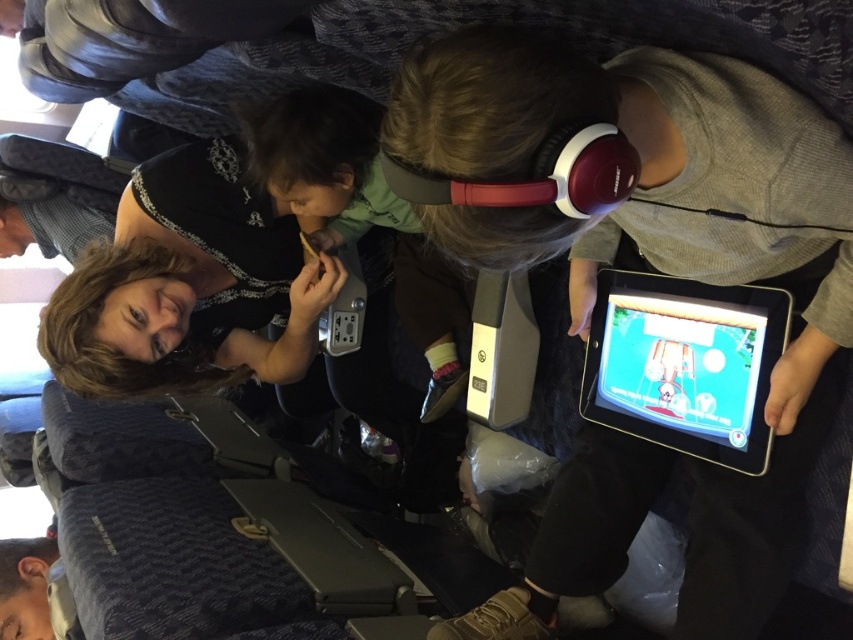
Is point (260, 289) in front of point (627, 321)?

No, (260, 289) is further to viewer.

Can you confirm if matte black dress at upper left is positioned to the right of black glossy tablet at center?

In fact, matte black dress at upper left is to the left of black glossy tablet at center.

Is point (271, 291) farther from viewer compared to point (755, 296)?

Yes, point (271, 291) is farther from viewer.

Where is `matte black dress at upper left`? The width and height of the screenshot is (853, 640). matte black dress at upper left is located at coordinates (189, 284).

Between matte black tablet at center and black glossy tablet at center, which one is positioned higher?

matte black tablet at center is higher up.

Does matte black tablet at center have a lesser width compared to black glossy tablet at center?

No, matte black tablet at center is not thinner than black glossy tablet at center.

Is point (788, 490) in front of point (726, 412)?

Yes.

Where is `matte black tablet at center`? matte black tablet at center is located at coordinates pyautogui.click(x=651, y=269).

Can you confirm if matte black tablet at center is positioned to the left of matte black dress at upper left?

Incorrect, matte black tablet at center is not on the left side of matte black dress at upper left.

Can you confirm if matte black tablet at center is taller than matte black dress at upper left?

Yes, matte black tablet at center is taller than matte black dress at upper left.

Does point (517, 266) come closer to viewer compared to point (96, 259)?

Yes, point (517, 266) is in front of point (96, 259).

The image size is (853, 640). In order to click on matte black tablet at center in this screenshot , I will do `click(651, 269)`.